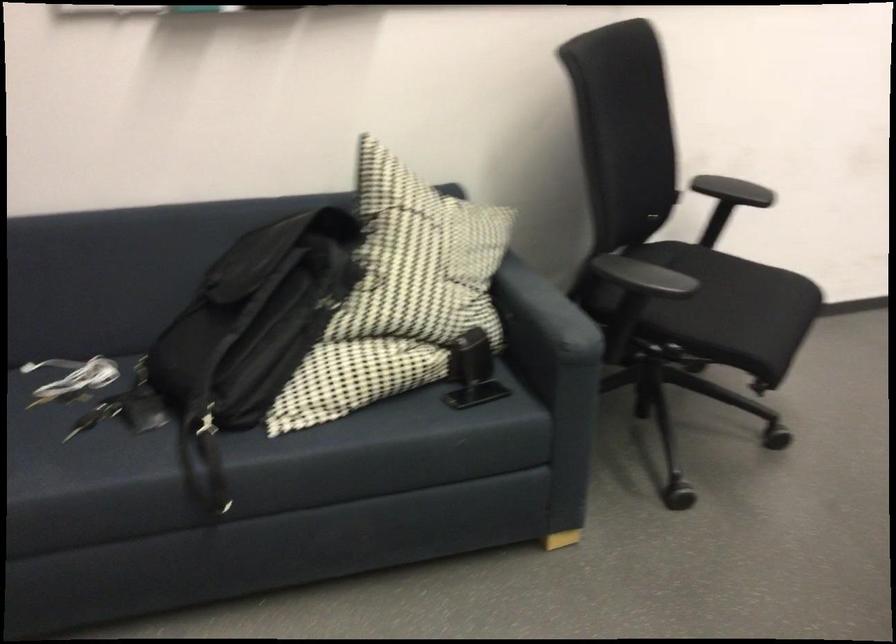
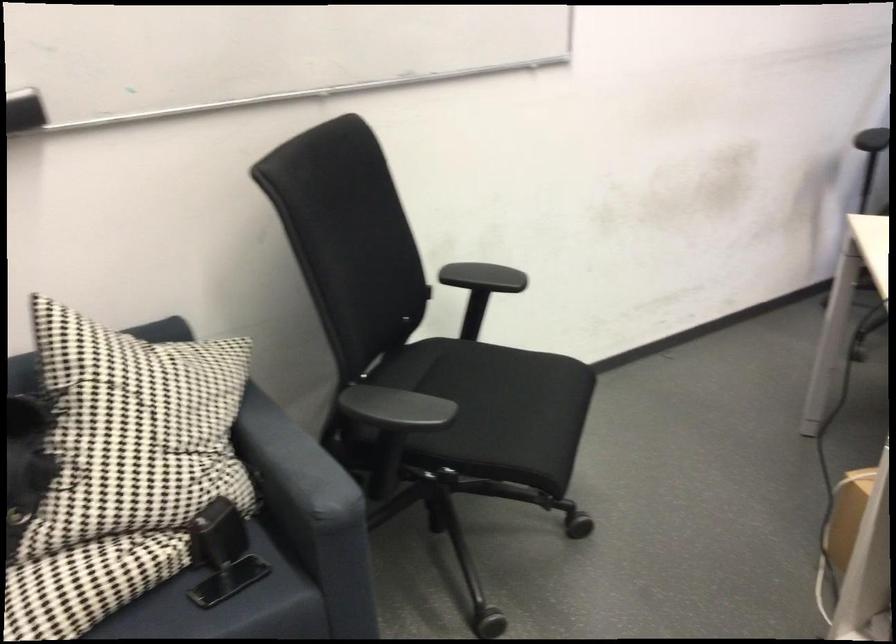
Locate, in the second image, the point that corresponds to point 469,410 in the first image.

(226, 605)